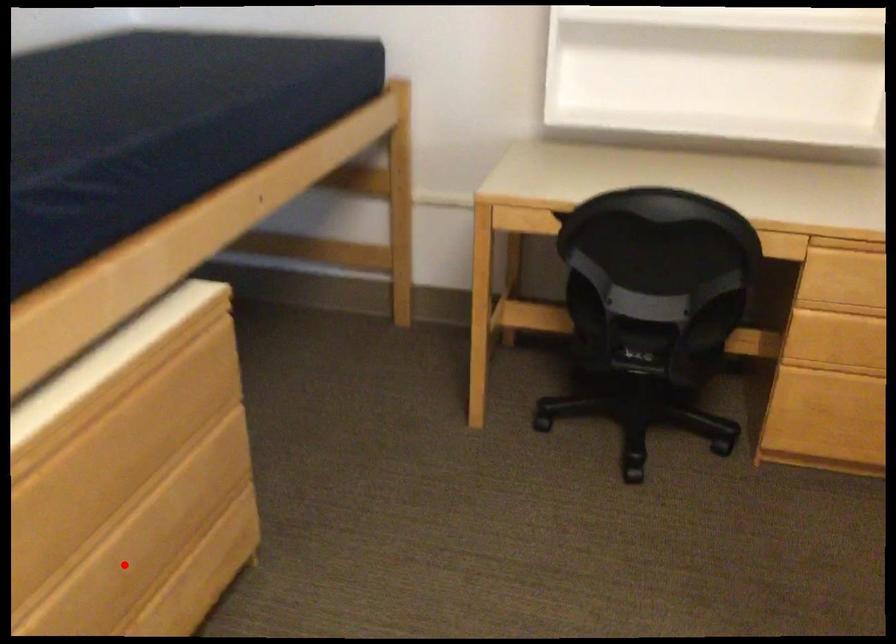
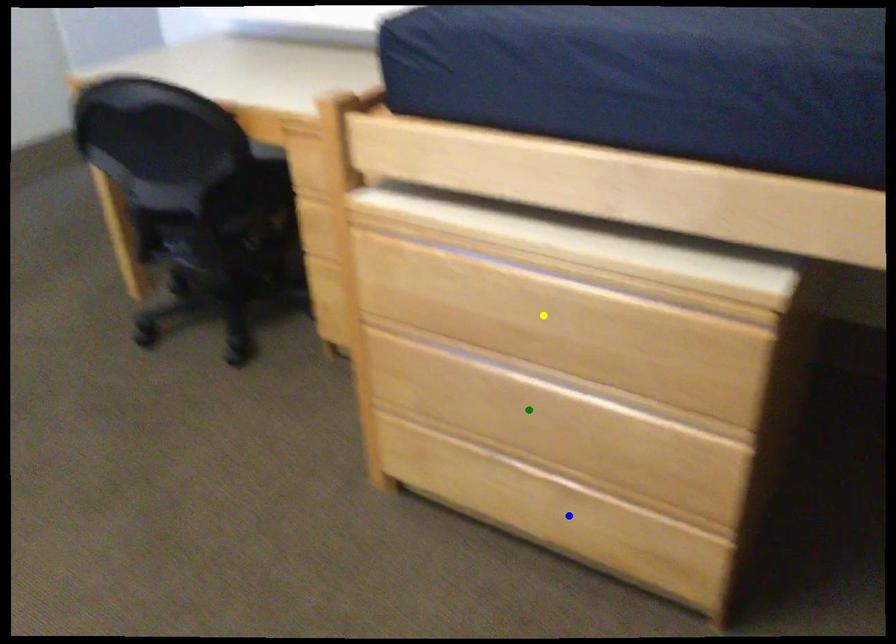
Question: I am providing you with two images of the same scene from different viewpoints. A red point is marked on the first image. You are given multiple points on the second image. Which point in image 2 is actually the same real-world point as the red point in image 1?

Choices:
 (A) blue point
 (B) green point
 (C) yellow point

Answer: (B)